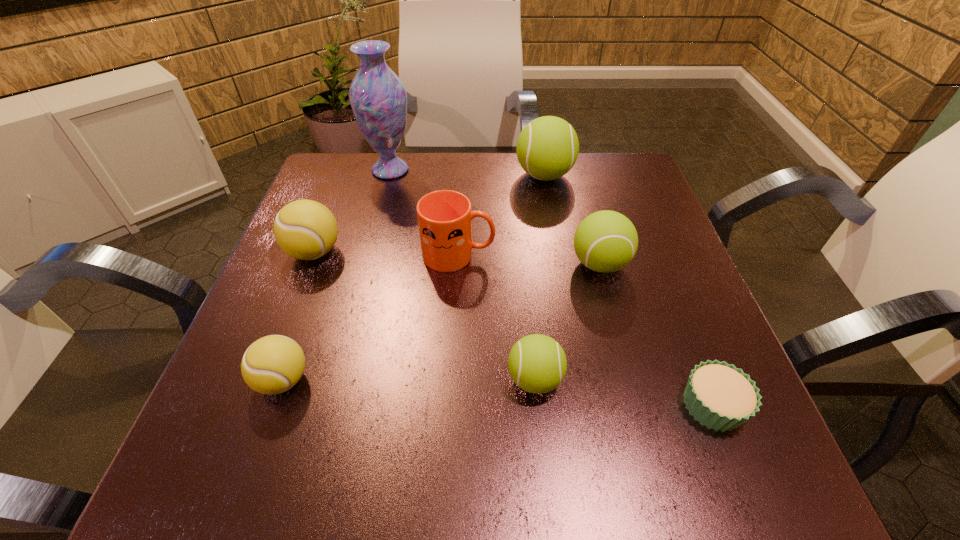
This screenshot has width=960, height=540. I want to click on cupcake, so click(720, 396).

Locate an element on the screen. the rightmost object is located at coordinates (720, 396).

The image size is (960, 540). Find the location of `free region located 0.060m on the front of the tallest object`. free region located 0.060m on the front of the tallest object is located at coordinates (383, 199).

This screenshot has height=540, width=960. I want to click on vacant area situated on the front of the farthest tennis ball, so click(x=564, y=283).

You are a GUI agent. You are given a task and a screenshot of the screen. Output one action in this format:
    pyautogui.click(x=<x>, y=<y>)
    Task: Click on the vacant space located on the handle side of the fifth object from right to left
    This screenshot has width=960, height=540.
    Given the screenshot: What is the action you would take?
    pyautogui.click(x=649, y=255)

You are a GUI agent. You are given a task and a screenshot of the screen. Output one action in this format:
    pyautogui.click(x=<x>, y=<y>)
    Task: Click on the vacant region located on the back of the farther yellow tennis ball
    Image resolution: width=960 pixels, height=540 pixels.
    Given the screenshot: What is the action you would take?
    pyautogui.click(x=332, y=206)

Identify the location of vacant area located 0.270m on the front of the second smallest green tennis ball. (640, 416).

Where is `free space located 0.220m on the back of the nearest green tennis ball`? The height and width of the screenshot is (540, 960). free space located 0.220m on the back of the nearest green tennis ball is located at coordinates (523, 264).

Locate an element on the screen. The image size is (960, 540). free region located 0.260m on the back of the nearer yellow tennis ball is located at coordinates (328, 252).

You are a GUI agent. You are given a task and a screenshot of the screen. Output one action in this format:
    pyautogui.click(x=<x>, y=<y>)
    Task: Click on the vacant space located on the left of the cupcake
    
    Given the screenshot: What is the action you would take?
    pyautogui.click(x=512, y=406)